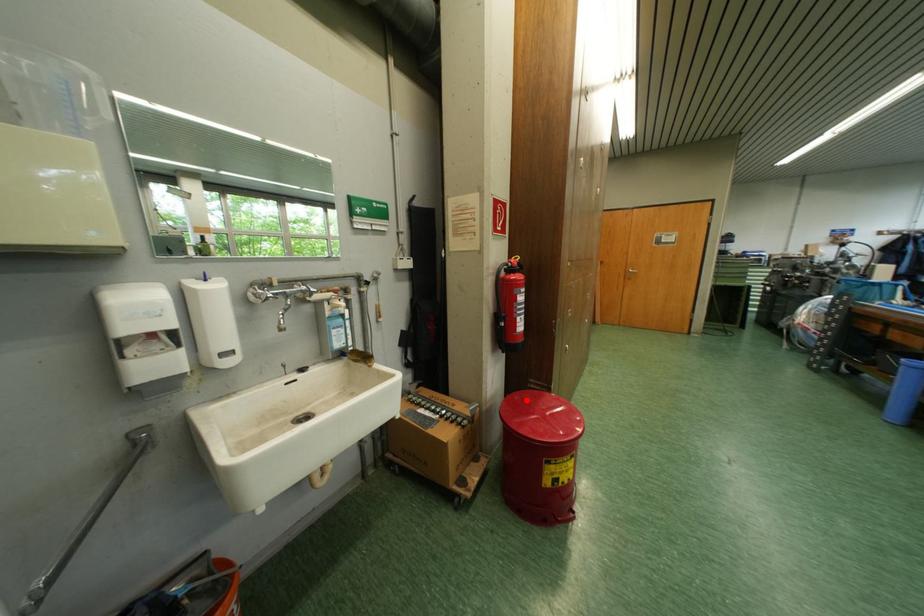
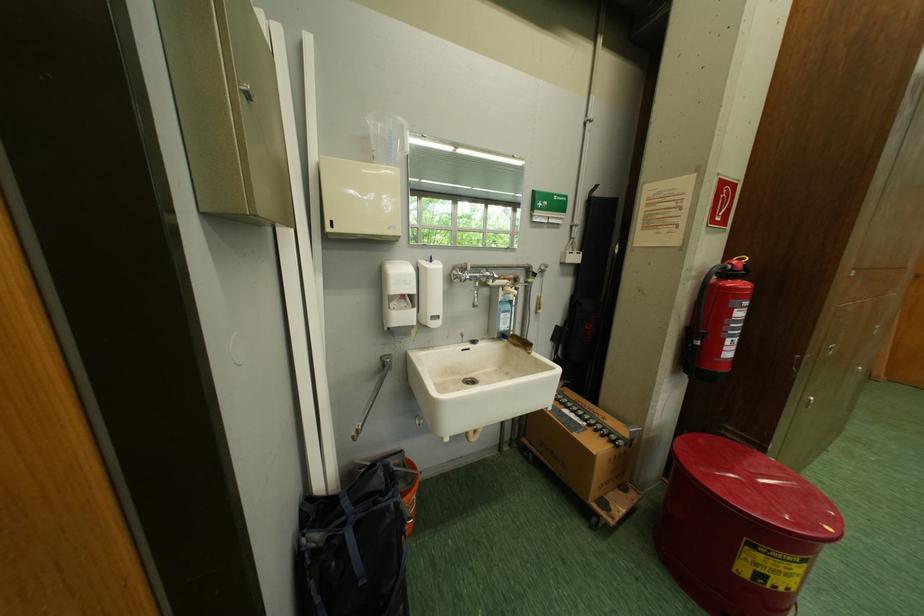
Question: I am providing you with two images of the same scene from different viewpoints. Image1 has a red point marked. In image2, the corresponding 3D location appears at what relative position? Reply with the corresponding letter.

Choices:
 (A) Closer
 (B) Farther

Answer: (B)